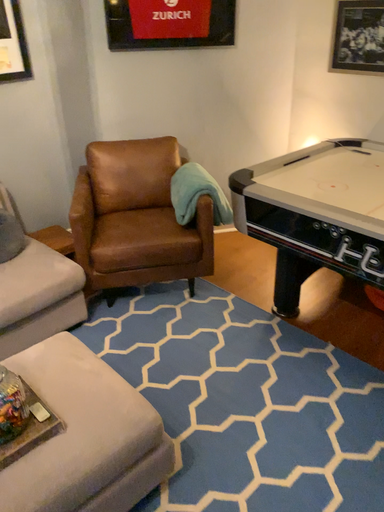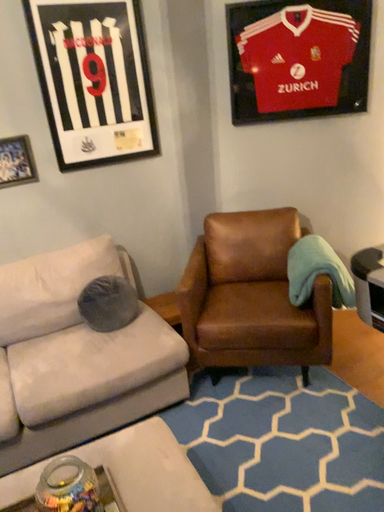
Question: How did the camera likely rotate when shooting the video?

Choices:
 (A) rotated left
 (B) rotated right

Answer: (A)